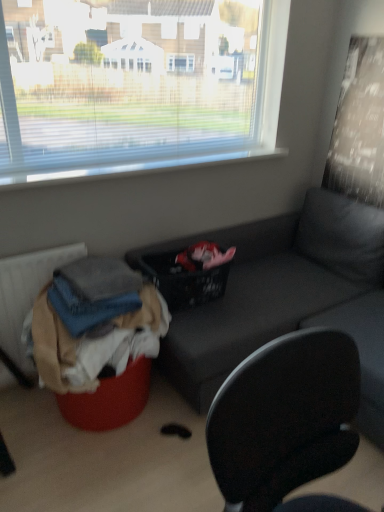
Question: From the image's perspective, is black woven basket at center above or below textured fabric radiator at lower left?

Choices:
 (A) above
 (B) below

Answer: (A)

Question: In the image, is black woven basket at center positioned in front of or behind textured fabric radiator at lower left?

Choices:
 (A) behind
 (B) front

Answer: (A)

Question: Based on their relative distances, which object is farther from the matte gray couch at center?

Choices:
 (A) black woven basket at center
 (B) denim fabric at lower left, which is the second clothing in bottom-to-top order
 (C) textured fabric radiator at lower left
 (D) denim fabric clothes at lower left, placed as the 1th clothing when sorted from bottom to top

Answer: (C)

Question: Estimate the real-world distances between objects in this image. Which object is farther from the denim fabric at lower left, which is the second clothing in bottom-to-top order?

Choices:
 (A) black woven basket at center
 (B) textured fabric radiator at lower left
 (C) denim fabric clothes at lower left, placed as the 1th clothing when sorted from bottom to top
 (D) matte gray couch at center

Answer: (D)